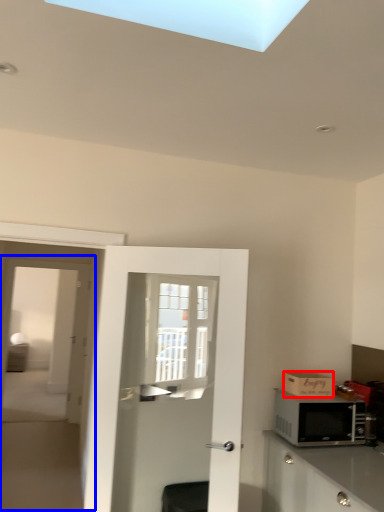
Question: Which object is further to the camera taking this photo, cardboard box (highlighted by a red box) or screen door (highlighted by a blue box)?

Choices:
 (A) cardboard box
 (B) screen door

Answer: (A)